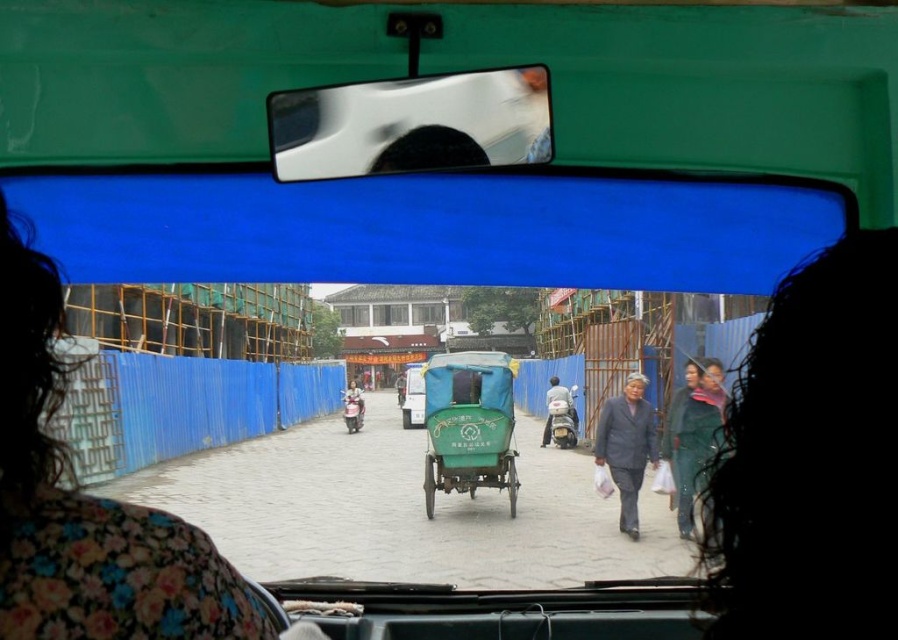
The image size is (898, 640). What are the coordinates of `floral fabric headscarf at left` in the screenshot? It's located at (87, 506).

Is floral fabric headscarf at left bigger than gray fabric coat at center?

No.

Where is `floral fabric headscarf at left`? The width and height of the screenshot is (898, 640). floral fabric headscarf at left is located at coordinates (87, 506).

In the scene shown: Is floral fabric headscarf at left positioned at the back of green matte tricycle at center?

No.

Does point (55, 464) come closer to viewer compared to point (406, 410)?

That is True.

Where is `floral fabric headscarf at left`? floral fabric headscarf at left is located at coordinates (87, 506).